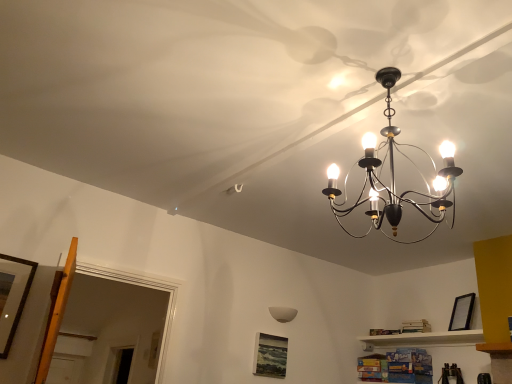
Question: Considering the relative sizes of matte black picture frame at lower center, positioned as the 1th picture frame in back-to-front order, and black matte picture frame at upper right, the 2th picture frame positioned from the front, in the image provided, is matte black picture frame at lower center, positioned as the 1th picture frame in back-to-front order, bigger than black matte picture frame at upper right, the 2th picture frame positioned from the front,?

Choices:
 (A) no
 (B) yes

Answer: (A)

Question: Can you confirm if matte black picture frame at lower center, arranged as the third picture frame when viewed from the top, is thinner than black matte picture frame at upper right, positioned as the third picture frame in left-to-right order?

Choices:
 (A) yes
 (B) no

Answer: (A)

Question: From the image's perspective, is matte black picture frame at lower center, positioned as the 2th picture frame in right-to-left order, on top of black matte picture frame at upper right, positioned as the third picture frame in left-to-right order?

Choices:
 (A) yes
 (B) no

Answer: (B)

Question: Considering the relative sizes of matte black picture frame at lower center, positioned as the 2th picture frame in right-to-left order, and black matte picture frame at upper right, the 2th picture frame positioned from the front, in the image provided, is matte black picture frame at lower center, positioned as the 2th picture frame in right-to-left order, taller than black matte picture frame at upper right, the 2th picture frame positioned from the front,?

Choices:
 (A) yes
 (B) no

Answer: (A)

Question: Can you confirm if matte black picture frame at lower center, arranged as the third picture frame when viewed from the top, is smaller than black matte picture frame at upper right, the second picture frame from the back?

Choices:
 (A) no
 (B) yes

Answer: (B)

Question: Could black matte picture frame at upper right, arranged as the 2th picture frame when viewed from the top, be considered to be inside matte black picture frame at lower center, the 2th picture frame when ordered from left to right?

Choices:
 (A) yes
 (B) no

Answer: (B)

Question: Does black matte picture frame at upper right, the second picture frame from the back, have a greater height compared to wooden picture frame at left, the third picture frame from the back?

Choices:
 (A) no
 (B) yes

Answer: (A)

Question: From the image's perspective, does black matte picture frame at upper right, the 1th picture frame positioned from the right, appear higher than wooden picture frame at left, marked as the 3th picture frame in a bottom-to-top arrangement?

Choices:
 (A) yes
 (B) no

Answer: (B)

Question: Is black matte picture frame at upper right, the 2th picture frame positioned from the front, not close to wooden picture frame at left, the 1th picture frame from the left?

Choices:
 (A) no
 (B) yes

Answer: (B)

Question: Can you confirm if black matte picture frame at upper right, positioned as the third picture frame in left-to-right order, is positioned to the right of wooden picture frame at left, which ranks as the first picture frame in top-to-bottom order?

Choices:
 (A) no
 (B) yes

Answer: (B)

Question: Can you confirm if black matte picture frame at upper right, arranged as the 2th picture frame when viewed from the top, is smaller than wooden picture frame at left, which is the 1th picture frame from front to back?

Choices:
 (A) no
 (B) yes

Answer: (A)

Question: Can you confirm if black matte picture frame at upper right, the second picture frame from the back, is bigger than wooden picture frame at left, which ranks as the first picture frame in top-to-bottom order?

Choices:
 (A) yes
 (B) no

Answer: (A)

Question: Does white matte lampshade at center have a smaller size compared to black matte picture frame at upper right, the second picture frame from the back?

Choices:
 (A) no
 (B) yes

Answer: (B)